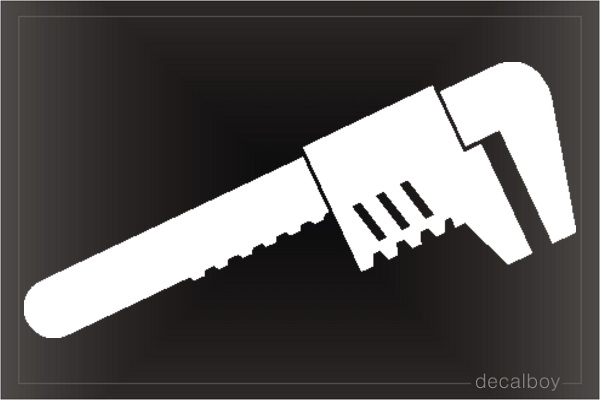
At what (x,y) coordinates should I click in order to perform the action: click on decal. Please return your answer as a coordinate pair (x, y). The image size is (600, 400). Looking at the image, I should click on (566, 39), (46, 40), (51, 366), (547, 340), (308, 365), (329, 45).